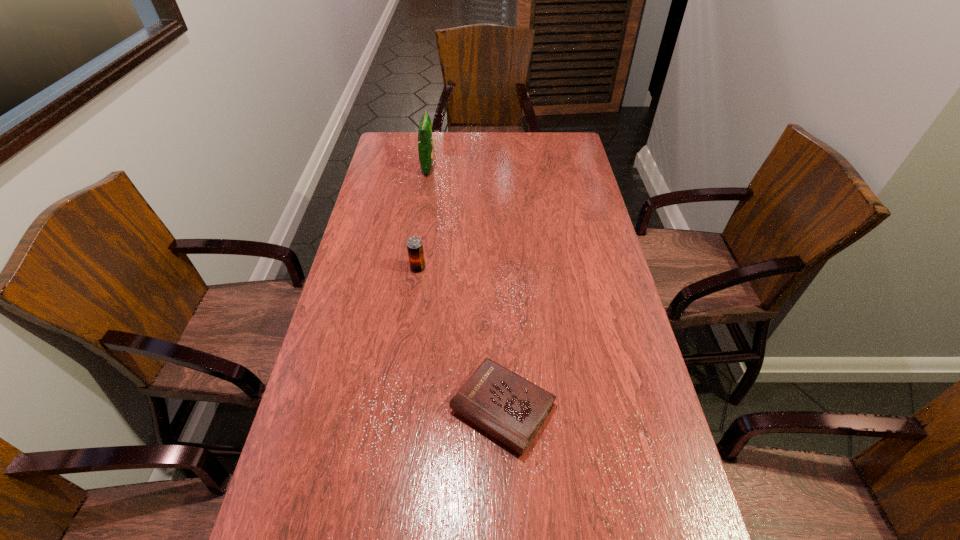
In the image, there is a desktop. Where is `vacant region at the far edge`? Image resolution: width=960 pixels, height=540 pixels. vacant region at the far edge is located at coordinates (447, 148).

In the image, there is a desktop. At what (x,y) coordinates should I click in order to perform the action: click on vacant space at the left edge. Please return your answer as a coordinate pair (x, y). The image size is (960, 540). Looking at the image, I should click on (396, 201).

Locate an element on the screen. This screenshot has width=960, height=540. vacant area at the right edge is located at coordinates (613, 279).

Find the location of a particular element. Image resolution: width=960 pixels, height=540 pixels. vacant space at the far left corner of the desktop is located at coordinates (409, 158).

Find the location of a particular element. This screenshot has width=960, height=540. vacant space that is in between the crisp (potato chip) and the shortest object is located at coordinates (466, 288).

In order to click on free spot between the shortest object and the crisp (potato chip) in this screenshot , I will do `click(466, 288)`.

Identify the location of empty space that is in between the tallest object and the second nearest object. The image size is (960, 540). (423, 218).

I want to click on vacant region between the second tallest object and the shortest object, so click(x=461, y=339).

The image size is (960, 540). I want to click on free point between the rightmost object and the tallest object, so click(466, 288).

You are a GUI agent. You are given a task and a screenshot of the screen. Output one action in this format:
    pyautogui.click(x=<x>, y=<y>)
    Task: Click on the vacant space that is in between the rightmost object and the farthest object
    
    Given the screenshot: What is the action you would take?
    pyautogui.click(x=466, y=288)